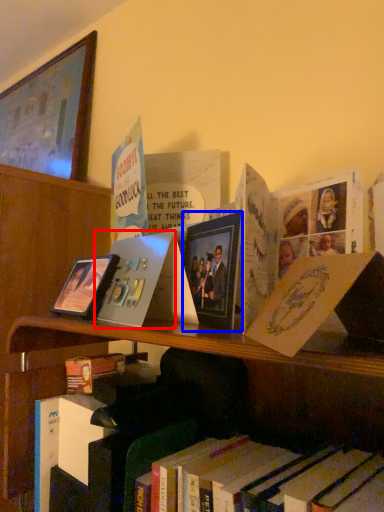
Question: Which of the following is the farthest to the observer, paperback book (highlighted by a red box) or picture frame (highlighted by a blue box)?

Choices:
 (A) paperback book
 (B) picture frame

Answer: (A)